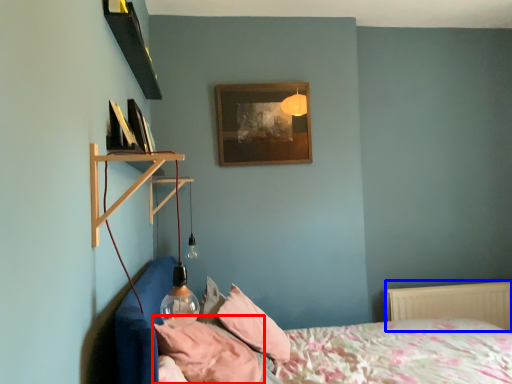
Question: Which object appears farthest to the camera in this image, pillow (highlighted by a red box) or radiator (highlighted by a blue box)?

Choices:
 (A) pillow
 (B) radiator

Answer: (B)